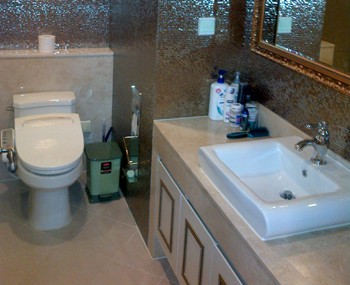
You are a GUI agent. You are given a task and a screenshot of the screen. Output one action in this format:
    pyautogui.click(x=<x>, y=<y>)
    Task: Click on the toilet
    The width and height of the screenshot is (350, 285).
    Given the screenshot: What is the action you would take?
    pyautogui.click(x=62, y=143)